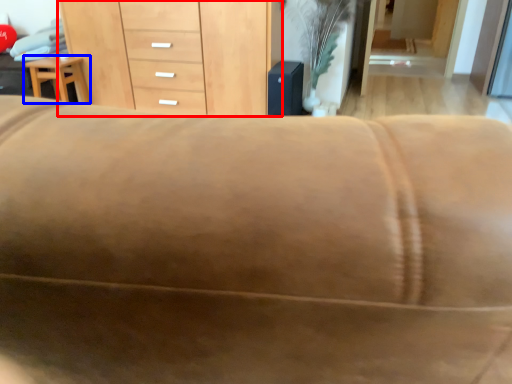
Question: Among these objects, which one is farthest to the camera, chest of drawers (highlighted by a red box) or furniture (highlighted by a blue box)?

Choices:
 (A) chest of drawers
 (B) furniture

Answer: (B)